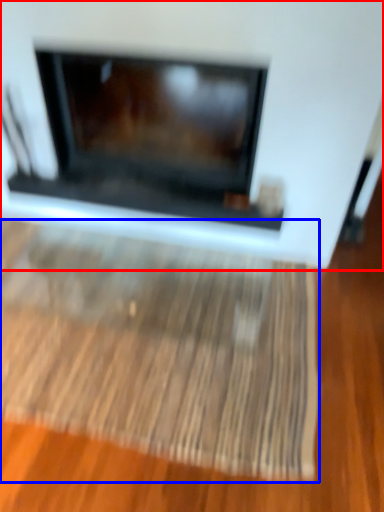
Question: Among these objects, which one is farthest to the camera, fireplace (highlighted by a red box) or mat (highlighted by a blue box)?

Choices:
 (A) fireplace
 (B) mat

Answer: (B)